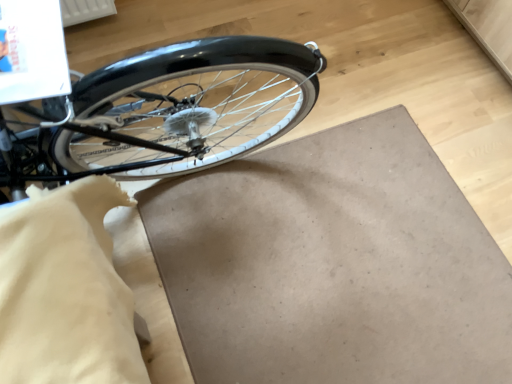
This screenshot has height=384, width=512. Find the location of `vacant area situated below brown cardboard at upper left (from a real-world perspective)`. vacant area situated below brown cardboard at upper left (from a real-world perspective) is located at coordinates (372, 277).